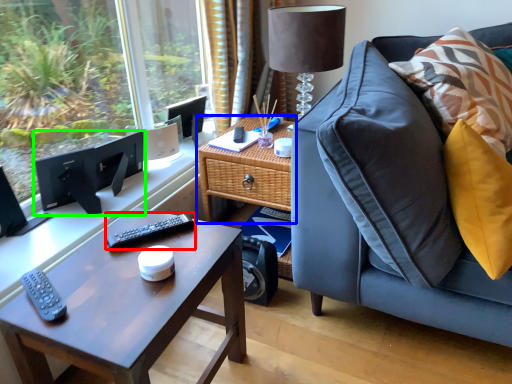
Question: Which object is positioned farthest from remote (highlighted by a red box)? Select from table (highlighted by a blue box) and computer monitor (highlighted by a green box).

Choices:
 (A) table
 (B) computer monitor

Answer: (B)